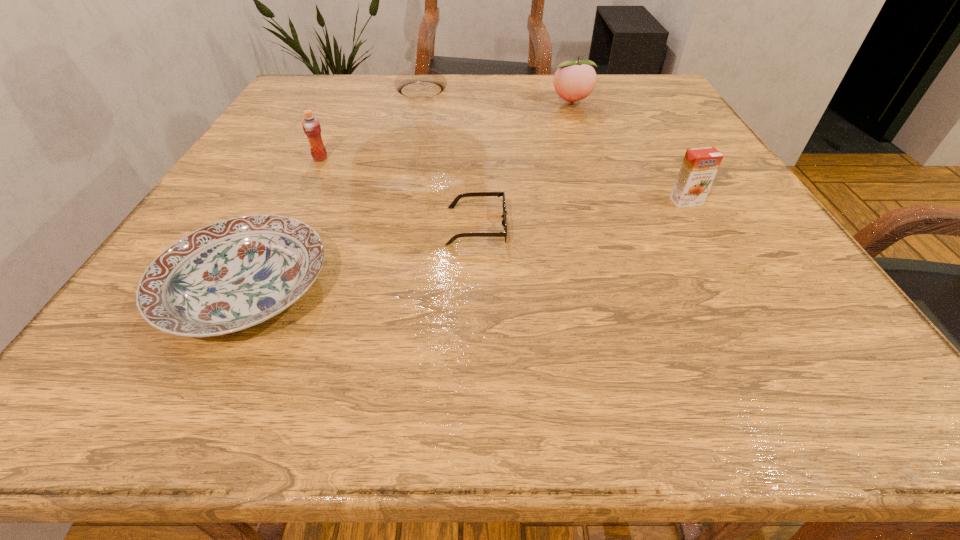
This screenshot has height=540, width=960. What are the coordinates of `free location that satisfies the following two spatial constraints: 1. on the front-facing side of the right orange juice; 2. on the left side of the table lamp` in the screenshot? It's located at (396, 201).

You are a GUI agent. You are given a task and a screenshot of the screen. Output one action in this format:
    pyautogui.click(x=<x>, y=<y>)
    Task: Click on the free spot that satisfies the following two spatial constraints: 1. on the back side of the second object from right to left; 2. on the left side of the plate
    The width and height of the screenshot is (960, 540).
    Given the screenshot: What is the action you would take?
    pyautogui.click(x=341, y=104)